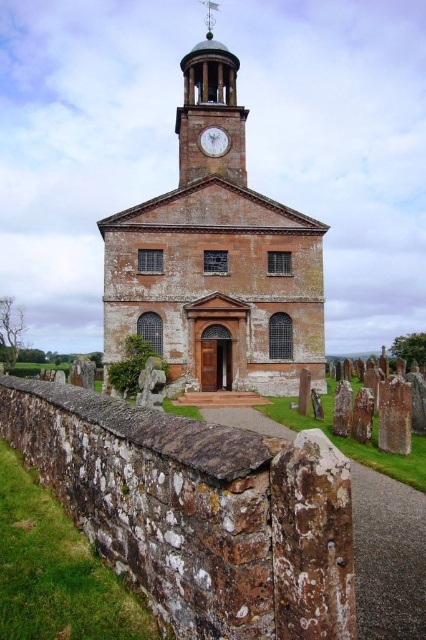
Between brown stone church at center and white glossy clock at upper center, which one has more height?

With more height is brown stone church at center.

Does brown stone church at center appear over white glossy clock at upper center?

Yes.

This screenshot has height=640, width=426. I want to click on brown stone church at center, so click(x=215, y=259).

Who is more forward, (178,166) or (215,138)?

Positioned in front is point (215,138).

Is light brown stone clock tower at upper center above white glossy clock at upper center?

Yes, light brown stone clock tower at upper center is above white glossy clock at upper center.

Which is behind, point (184, 161) or point (216, 144)?

The point (216, 144) is more distant.

Identify the location of light brown stone clock tower at upper center. The width and height of the screenshot is (426, 640). (210, 113).

Describe the element at coordinates (215, 259) in the screenshot. I see `brown stone church at center` at that location.

Locate an element on the screen. This screenshot has width=426, height=640. brown stone church at center is located at coordinates (215, 259).